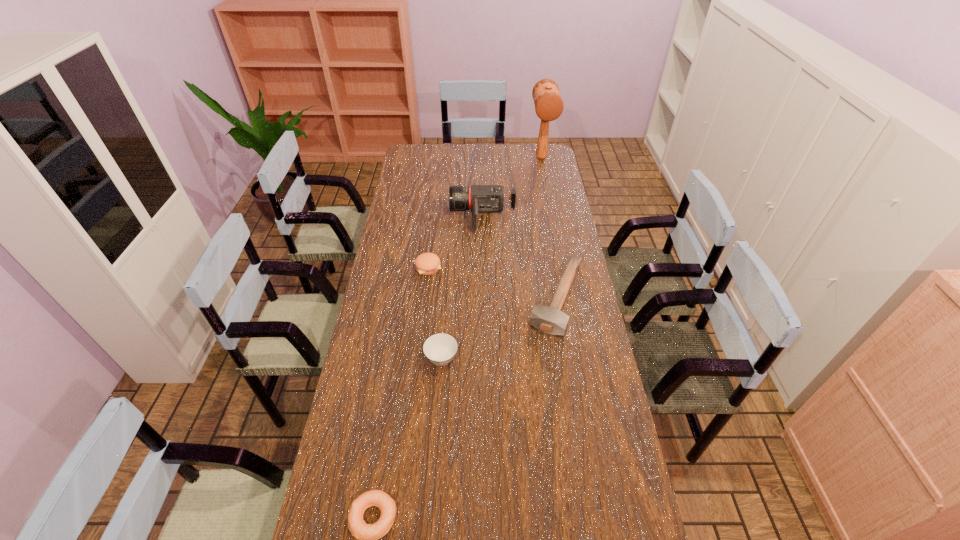
This screenshot has height=540, width=960. I want to click on free space located on the lens of the fifth nearest object, so click(410, 215).

What are the coordinates of `vacant space located on the right of the soup bowl` in the screenshot? It's located at (502, 359).

I want to click on free space located 0.360m on the back of the nearer mallet, so click(x=542, y=209).

This screenshot has width=960, height=540. Find the location of `vacant space located on the right of the patty`. vacant space located on the right of the patty is located at coordinates (528, 267).

Locate an element on the screen. Image resolution: width=960 pixels, height=540 pixels. object that is at the far edge is located at coordinates (549, 106).

This screenshot has height=540, width=960. Find the location of `object at the left edge`. object at the left edge is located at coordinates (427, 263).

You are a GUI agent. You are given a task and a screenshot of the screen. Output one action in this format:
    pyautogui.click(x=<x>, y=<y>)
    Task: Click on the object situated at the far right corner
    This screenshot has width=960, height=540.
    Given the screenshot: What is the action you would take?
    pyautogui.click(x=549, y=106)

Identify the location of free space at the far edge of the desktop. (450, 166).

The width and height of the screenshot is (960, 540). I want to click on free location at the left edge of the desktop, so click(389, 281).

At what (x,y) coordinates should I click in order to perform the action: click on free spot at the right edge of the desktop. Please return your answer as a coordinate pair (x, y). Looking at the image, I should click on (554, 174).